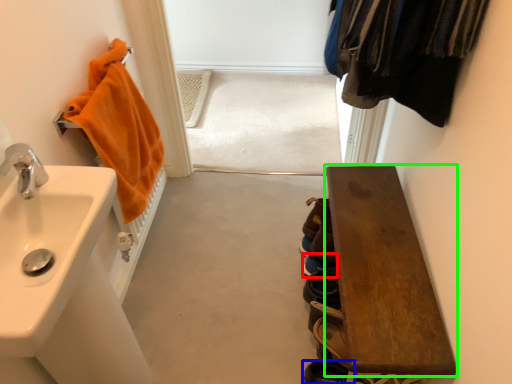
Question: Which object is positioned farthest from shoe (highlighted by a red box)? Select from shoe (highlighted by a blue box) and furniture (highlighted by a green box).

Choices:
 (A) shoe
 (B) furniture

Answer: (A)